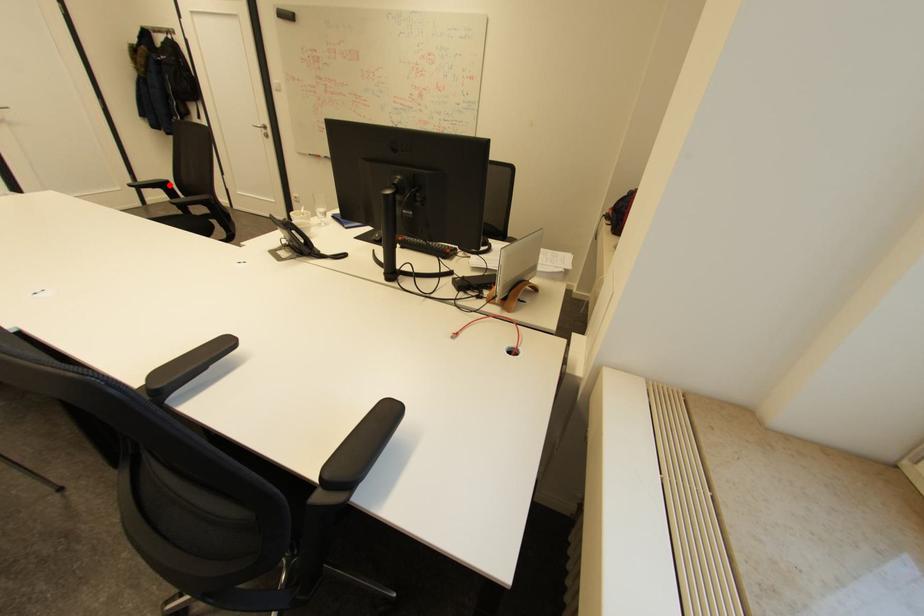
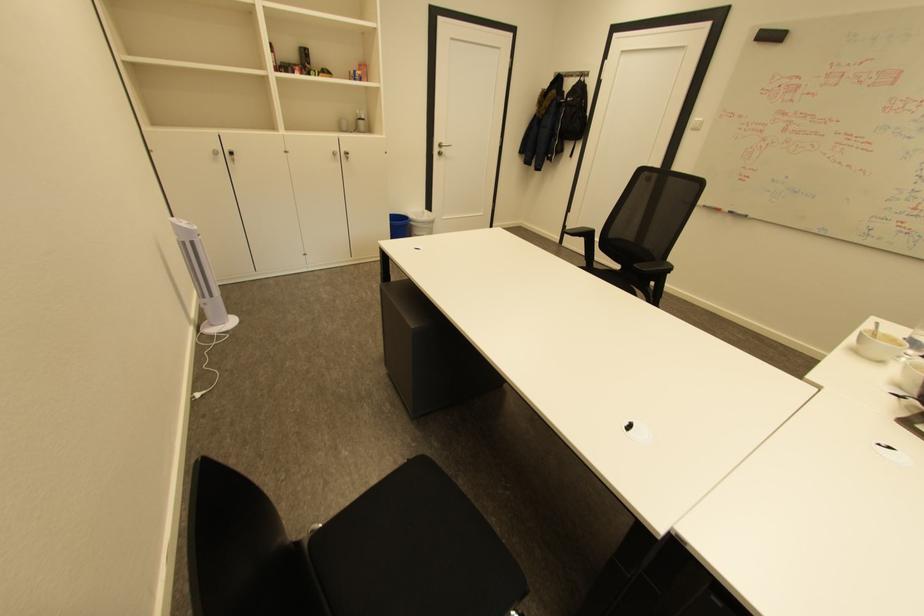
Question: I am providing you with two images of the same scene from different viewpoints. A red point is shown in image1. For the corresponding object point in image2, is it positioned nearer or farther from the camera?

Choices:
 (A) Nearer
 (B) Farther

Answer: (A)